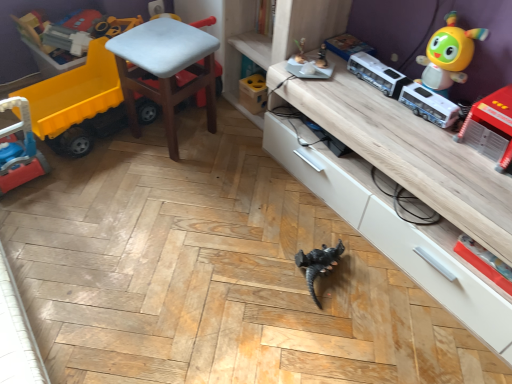
At what (x,y) coordinates should I click in order to perform the action: click on vacant region to the left of shiny yellow toy at upper right, the second toy viewed from the right. Please return your answer as a coordinate pair (x, y). Looking at the image, I should click on click(x=376, y=101).